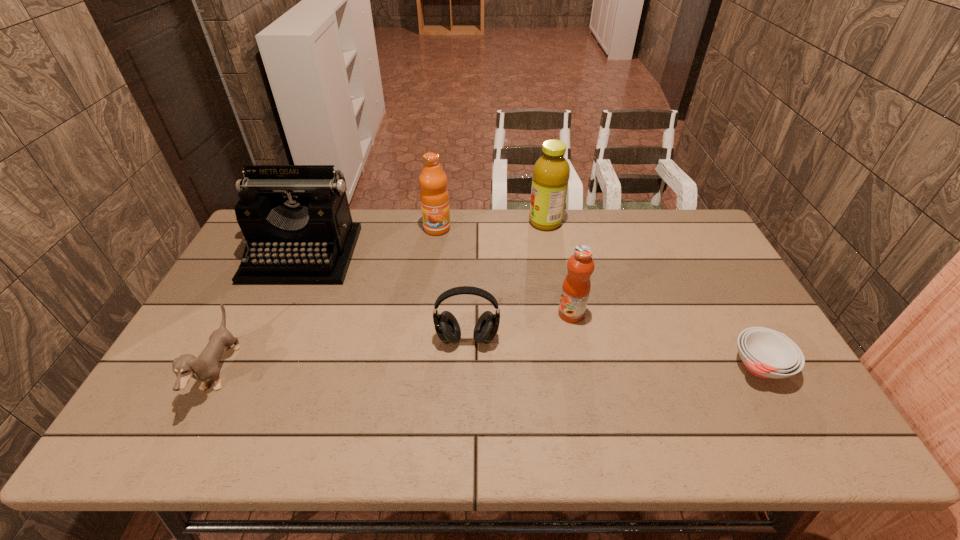
This screenshot has width=960, height=540. I want to click on free point between the typewriter and the fifth tallest object, so click(385, 296).

You are a GUI agent. You are given a task and a screenshot of the screen. Output one action in this format:
    pyautogui.click(x=<x>, y=<y>)
    Task: Click on the free area in between the rightmost object and the puppy
    Image resolution: width=960 pixels, height=540 pixels.
    Given the screenshot: What is the action you would take?
    tap(490, 369)

Where is `vacant area between the third shortest object and the leftmost fruit juice`? vacant area between the third shortest object and the leftmost fruit juice is located at coordinates (452, 284).

At what (x,y) coordinates should I click in order to perform the action: click on vacant space that is in between the typewriter and the shortest object. Please return your answer as a coordinate pair (x, y). The image size is (960, 540). Looking at the image, I should click on (531, 310).

Where is `the closest object to the headset`? the closest object to the headset is located at coordinates (576, 287).

Point out which object is positioned as the nearest to the puppy. Please provide its 2D coordinates. Your answer should be formatted as a tuple, i.e. [(x, y)], where the tuple contains the x and y coordinates of a point satisfying the conditions above.

[(296, 220)]

Identify which fruit juice is the closest to the soup bowl. Please provide its 2D coordinates. Your answer should be formatted as a tuple, i.e. [(x, y)], where the tuple contains the x and y coordinates of a point satisfying the conditions above.

[(576, 287)]

Find the location of a particular element. Image resolution: width=960 pixels, height=540 pixels. fruit juice identified as the third closest to the headset is located at coordinates (551, 172).

Where is `vacant region that satisfies the following two spatial constraints: 1. on the ear cups of the headset; 2. on the left side of the rightmost object`? The image size is (960, 540). vacant region that satisfies the following two spatial constraints: 1. on the ear cups of the headset; 2. on the left side of the rightmost object is located at coordinates (467, 366).

The image size is (960, 540). What are the coordinates of `vacant space that satisfies the following two spatial constraints: 1. on the front label of the soup bowl; 2. on the left side of the nearest fruit juice` in the screenshot? It's located at (582, 366).